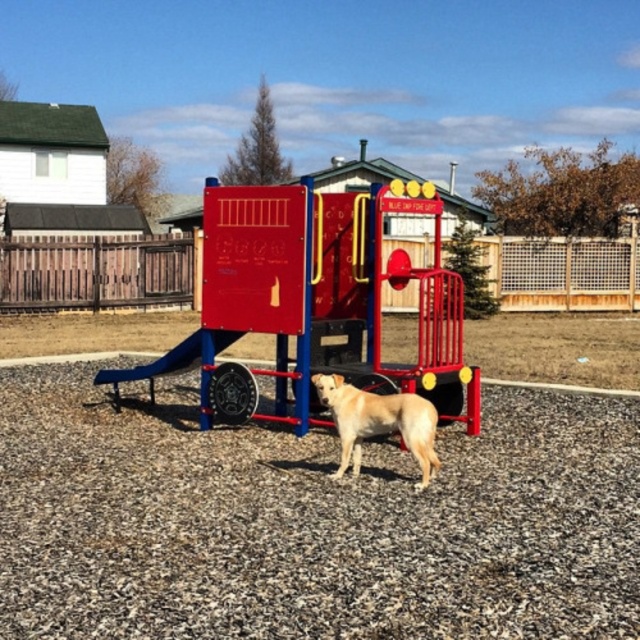
Looking at this image, you are a parent trying to ensure your child has enough space to play safely around the metallic red playground equipment at center and the golden fur dog at center. Based on their sizes, which object takes up more space in the playground?

The golden fur dog at center takes up more space than the metallic red playground equipment at center, as the metallic red playground equipment at center occupies less space than golden fur dog at center.

You are standing at the playground and see two points marked in the image. The first point is at coordinates point (323, 385) and the second point is at point (220, 337). From your perspective, which point is closer to you?

Point (323, 385) is in front of point (220, 337), so it is closer to you.

You are a parent trying to ensure your child stays within a safe distance from the playground equipment. If the recommended safe distance from the slide is 5 feet, can the golden fur dog at center stay within this distance while being near the metallic blue slide at center?

The golden fur dog at center is 7.60 feet away from the metallic blue slide at center, which exceeds the recommended safe distance of 5 feet. Therefore, the dog is outside the recommended safety zone.